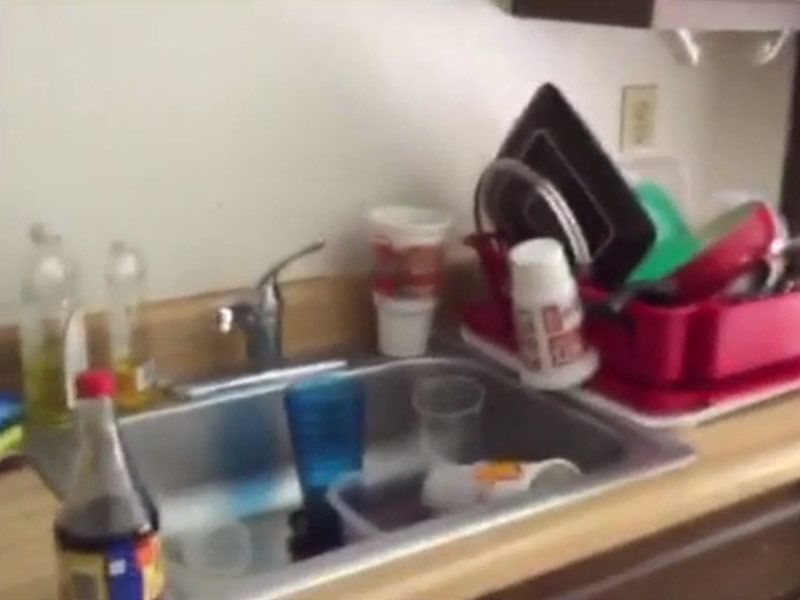
Image resolution: width=800 pixels, height=600 pixels. What are the coordinates of `soap bottles` in the screenshot? It's located at (49, 324), (130, 332).